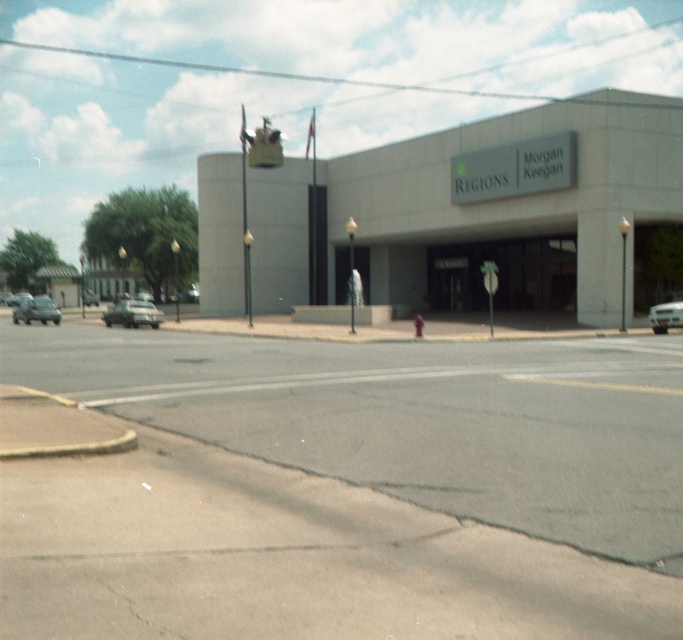
Question: Is silver metallic sedan at left to the right of silver metallic car at right from the viewer's perspective?

Choices:
 (A) no
 (B) yes

Answer: (A)

Question: Which of the following is the closest to the observer?

Choices:
 (A) silver metallic sedan at left
 (B) shiny silver sedan at left
 (C) silver metallic car at right

Answer: (C)

Question: Among these points, which one is nearest to the camera?

Choices:
 (A) (38, 308)
 (B) (660, 323)
 (C) (125, 305)

Answer: (B)

Question: Can you confirm if shiny silver sedan at left is positioned above silver metallic car at right?

Choices:
 (A) yes
 (B) no

Answer: (A)

Question: Among these objects, which one is nearest to the camera?

Choices:
 (A) silver metallic sedan at left
 (B) silver metallic car at right

Answer: (B)

Question: Does shiny silver sedan at left appear on the right side of silver metallic car at right?

Choices:
 (A) no
 (B) yes

Answer: (A)